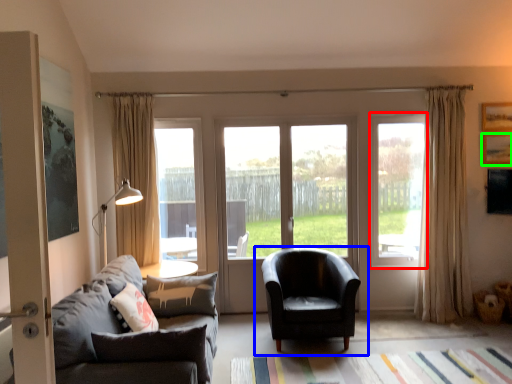
Question: Estimate the real-world distances between objects in this image. Which object is farther from window (highlighted by a red box), chair (highlighted by a blue box) or picture frame (highlighted by a green box)?

Choices:
 (A) chair
 (B) picture frame

Answer: (A)